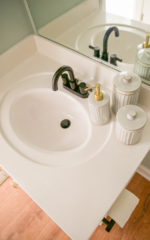
Image resolution: width=150 pixels, height=240 pixels. I want to click on toilet paper, so click(123, 210).